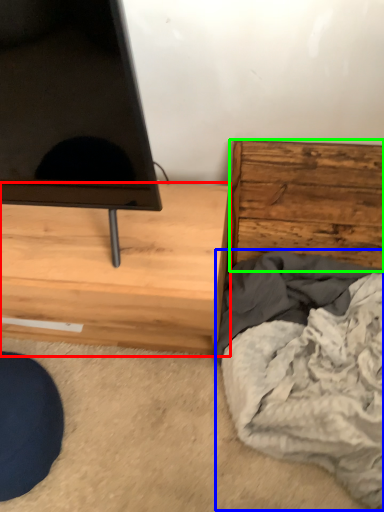
Question: Which is nearer to the chest of drawers (highlighted by a red box)? blanket (highlighted by a blue box) or chest of drawers (highlighted by a green box).

Choices:
 (A) blanket
 (B) chest of drawers

Answer: (A)